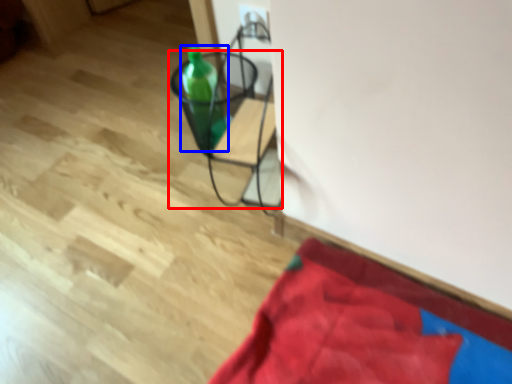
Question: Which object appears closest to the camera in this image, furniture (highlighted by a red box) or bottle (highlighted by a blue box)?

Choices:
 (A) furniture
 (B) bottle

Answer: (A)